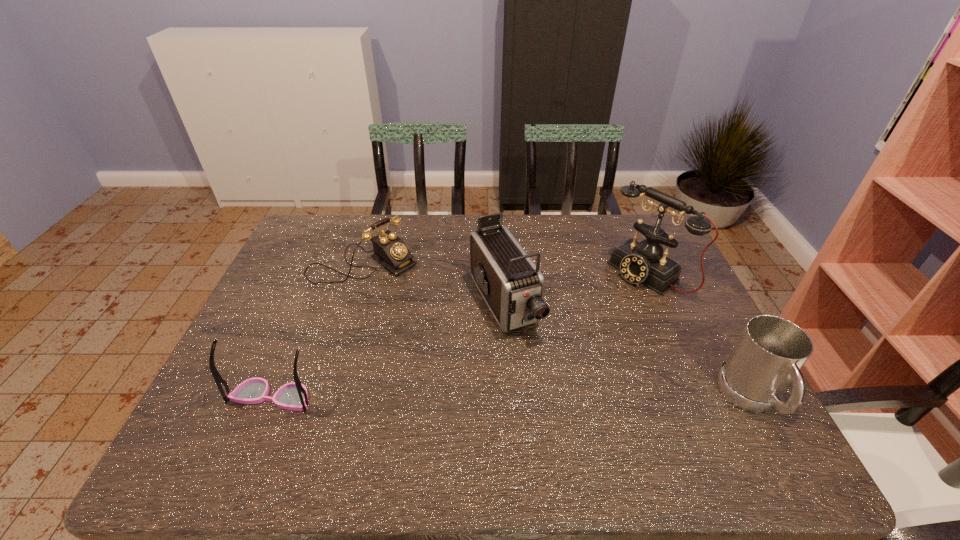
Locate an element on the screen. The width and height of the screenshot is (960, 540). free space at the far right corner of the desktop is located at coordinates (626, 227).

Where is `vacant space at the near right corner of the desktop`? This screenshot has height=540, width=960. vacant space at the near right corner of the desktop is located at coordinates (713, 413).

Locate an element on the screen. free space between the taller telephone and the camcorder is located at coordinates (576, 289).

This screenshot has width=960, height=540. Find the location of `free space that is in between the left telephone and the spectacles`. free space that is in between the left telephone and the spectacles is located at coordinates (318, 330).

The image size is (960, 540). I want to click on vacant point located between the mug and the right telephone, so click(699, 337).

Find the location of a particular element. free spot between the spectacles and the taller telephone is located at coordinates (459, 336).

Find the location of a particular element. This screenshot has height=540, width=960. free space that is in between the third object from left to right and the shorter telephone is located at coordinates (434, 284).

You are a GUI agent. You are given a task and a screenshot of the screen. Output one action in this format:
    pyautogui.click(x=<x>, y=<y>)
    Task: Click on the vacant space that is in between the third object from left to right and the spectacles
    The image size is (960, 540).
    Given the screenshot: What is the action you would take?
    pyautogui.click(x=389, y=350)

This screenshot has height=540, width=960. Find the location of `vacant area that lies between the mug and the right telephone`. vacant area that lies between the mug and the right telephone is located at coordinates (699, 337).

Locate an element on the screen. free space between the spectacles and the taller telephone is located at coordinates (459, 336).